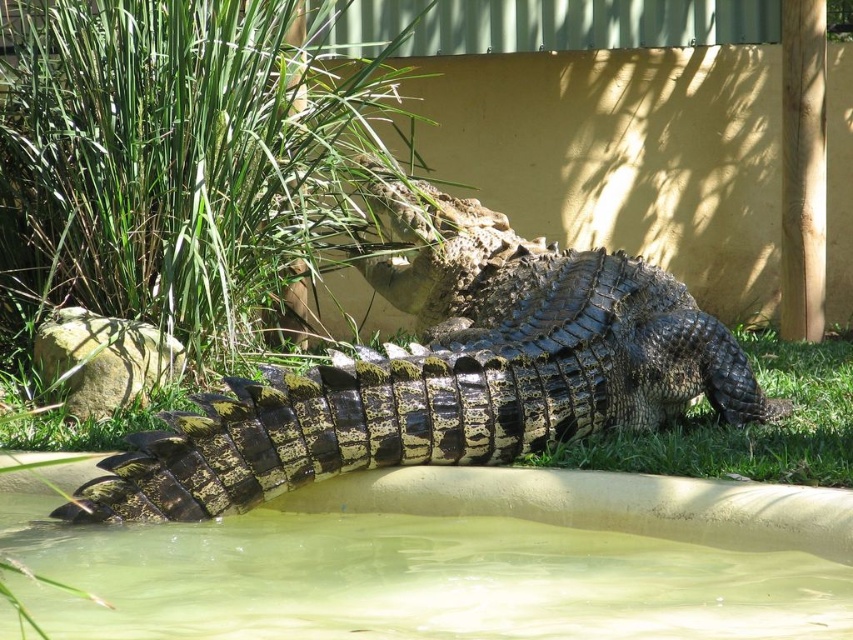
Can you confirm if shiny black crocodile at center is thinner than greenish murky water at bottom?

No, shiny black crocodile at center is not thinner than greenish murky water at bottom.

Does shiny black crocodile at center have a larger size compared to greenish murky water at bottom?

Yes, shiny black crocodile at center is bigger than greenish murky water at bottom.

The width and height of the screenshot is (853, 640). Identify the location of shiny black crocodile at center. (445, 372).